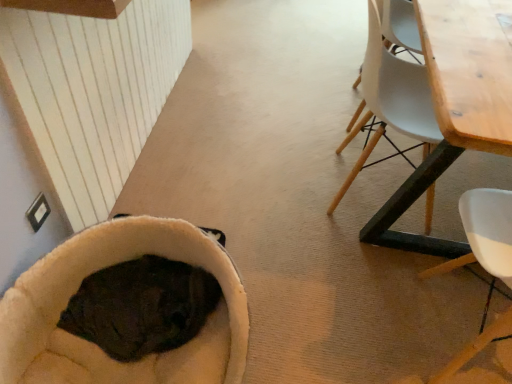
Question: Is wooden chair at right beside soft beige bean bag at lower left?

Choices:
 (A) yes
 (B) no

Answer: (B)

Question: Does wooden chair at right have a lesser width compared to soft beige bean bag at lower left?

Choices:
 (A) no
 (B) yes

Answer: (B)

Question: From the image's perspective, is wooden chair at right above soft beige bean bag at lower left?

Choices:
 (A) no
 (B) yes

Answer: (B)

Question: Can you confirm if wooden chair at right is shorter than soft beige bean bag at lower left?

Choices:
 (A) no
 (B) yes

Answer: (A)

Question: Is wooden chair at right taller than soft beige bean bag at lower left?

Choices:
 (A) no
 (B) yes

Answer: (B)

Question: Is wooden chair at right to the left of soft beige bean bag at lower left from the viewer's perspective?

Choices:
 (A) yes
 (B) no

Answer: (B)

Question: Is soft beige bean bag at lower left oriented towards wooden chair at right?

Choices:
 (A) yes
 (B) no

Answer: (B)

Question: Does soft beige bean bag at lower left have a larger size compared to wooden chair at right?

Choices:
 (A) no
 (B) yes

Answer: (A)

Question: Is wooden chair at right surrounded by soft beige bean bag at lower left?

Choices:
 (A) yes
 (B) no

Answer: (B)

Question: Can you confirm if soft beige bean bag at lower left is thinner than wooden chair at right?

Choices:
 (A) no
 (B) yes

Answer: (A)

Question: From the image's perspective, is soft beige bean bag at lower left located beneath wooden chair at right?

Choices:
 (A) no
 (B) yes

Answer: (B)

Question: Does soft beige bean bag at lower left come in front of wooden chair at right?

Choices:
 (A) no
 (B) yes

Answer: (A)

Question: Can you confirm if wooden table at right is shorter than wooden chair at right?

Choices:
 (A) yes
 (B) no

Answer: (B)